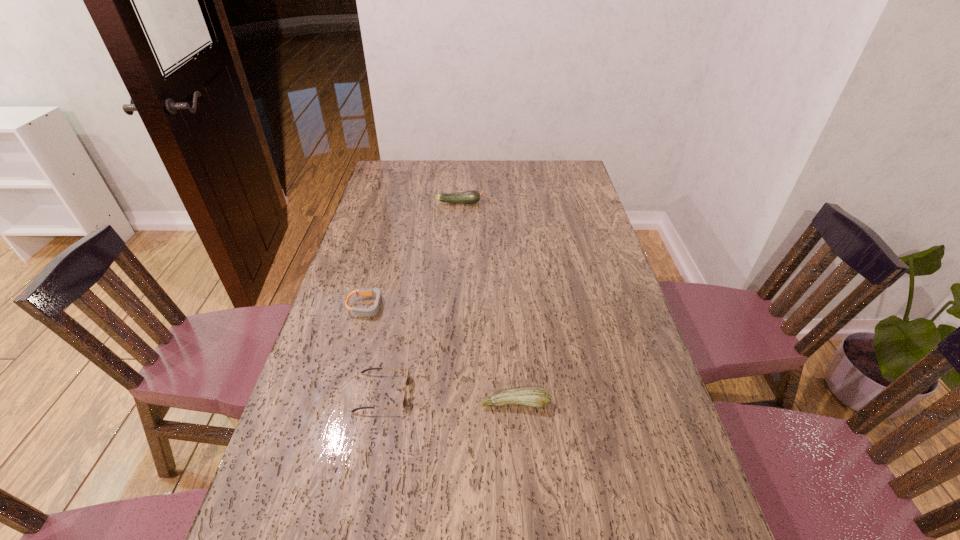
Where is `vacant point at the far edge`? This screenshot has width=960, height=540. vacant point at the far edge is located at coordinates (526, 174).

The image size is (960, 540). I want to click on free spot at the left edge of the desktop, so click(338, 352).

This screenshot has height=540, width=960. What are the coordinates of `vacant space at the right edge` in the screenshot? It's located at tap(612, 260).

Identify the location of unoccupied position between the sunglasses and the nearer zucchini. The width and height of the screenshot is (960, 540). (448, 397).

Where is `blank region between the farther zucchini and the third nearest object`? Image resolution: width=960 pixels, height=540 pixels. blank region between the farther zucchini and the third nearest object is located at coordinates (414, 254).

You are a GUI agent. You are given a task and a screenshot of the screen. Output one action in this format:
    pyautogui.click(x=<x>, y=<y>)
    Task: Click on the empty space that is in between the third nearest object and the nearer zucchini
    Image resolution: width=960 pixels, height=540 pixels.
    Given the screenshot: What is the action you would take?
    pyautogui.click(x=442, y=355)

Locate which object is the third closest to the sunglasses. Please provide its 2D coordinates. Your answer should be formatted as a tuple, i.e. [(x, y)], where the tuple contains the x and y coordinates of a point satisfying the conditions above.

[(472, 196)]

The height and width of the screenshot is (540, 960). In order to click on the closest object relative to the nearer zucchini in this screenshot , I will do `click(407, 382)`.

Find the location of a particular element. This screenshot has width=960, height=540. zucchini that stands as the second closest to the sunglasses is located at coordinates (472, 196).

This screenshot has height=540, width=960. I want to click on zucchini identified as the second closest to the goggles, so click(x=472, y=196).